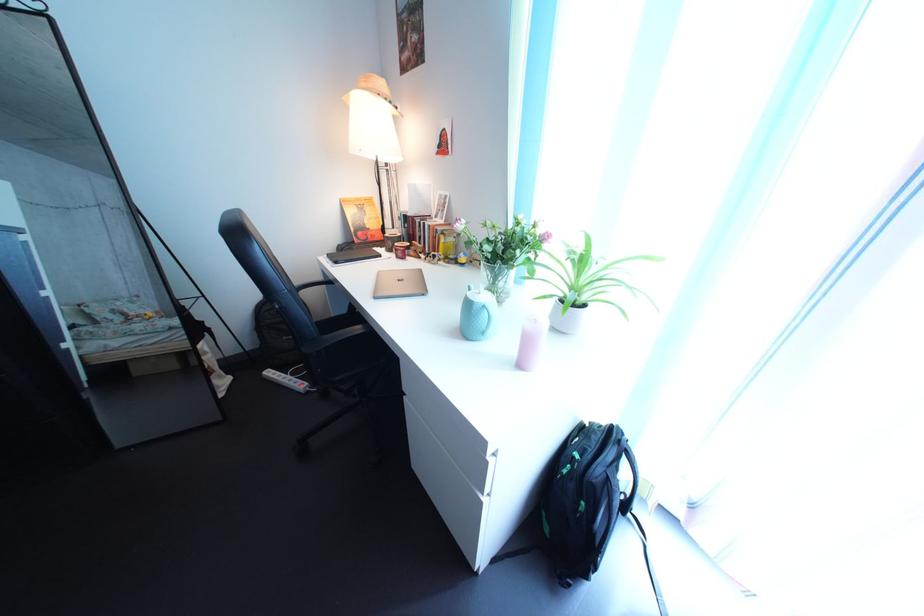
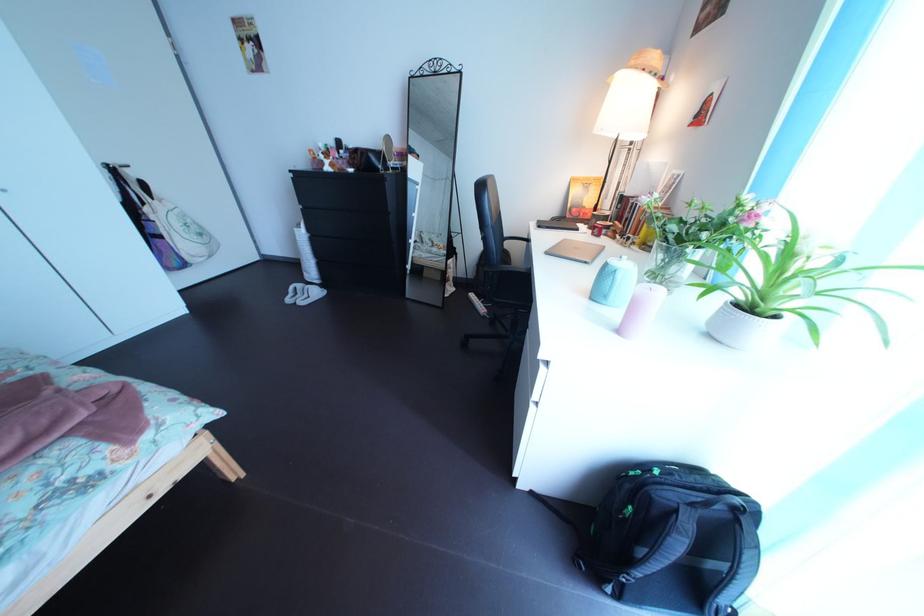
Locate, in the second image, the point that corresponds to point 503,342 in the first image.

(626, 307)